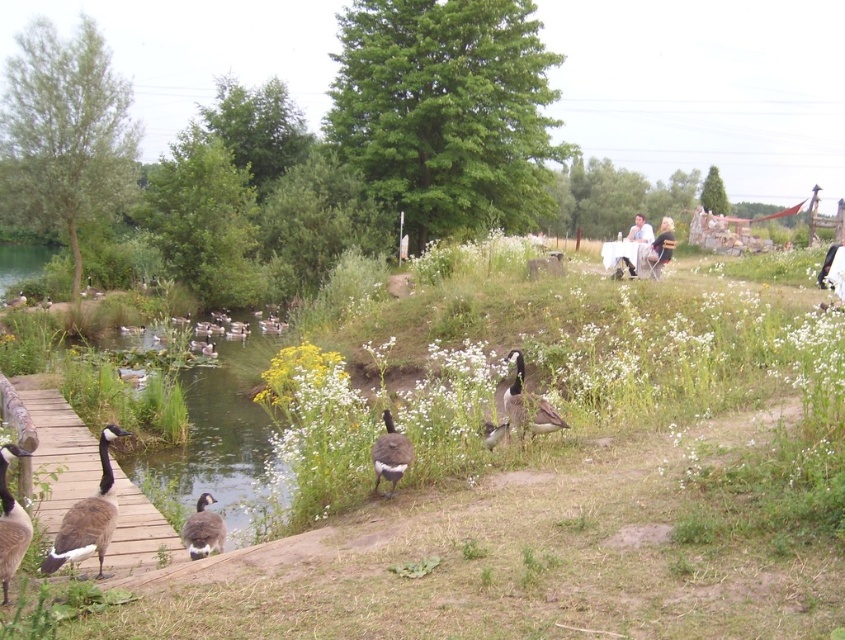
Where is `brown feathered duck at left`? Image resolution: width=845 pixels, height=640 pixels. brown feathered duck at left is located at coordinates (88, 516).

Is brown feathered duck at left thinner than gray matte duck at lower left?

Incorrect, brown feathered duck at left's width is not less than gray matte duck at lower left's.

Is point (107, 436) positioned behind point (211, 512)?

No, it is in front of (211, 512).

Locate an element on the screen. brown feathered duck at left is located at coordinates (88, 516).

Does white downy goose at center have a smaller size compared to white matte duck at center?

Incorrect, white downy goose at center is not smaller in size than white matte duck at center.

Who is positioned more to the right, white downy goose at center or white matte duck at center?

white downy goose at center is more to the right.

Where is `white downy goose at center`? white downy goose at center is located at coordinates (527, 404).

This screenshot has height=640, width=845. In order to click on white downy goose at center in this screenshot , I will do `click(527, 404)`.

Does brown fuzzy duck at center have a greater width compared to gray matte duck at lower left?

Incorrect, brown fuzzy duck at center's width does not surpass gray matte duck at lower left's.

Can you confirm if brown fuzzy duck at center is taller than gray matte duck at lower left?

Yes.

What do you see at coordinates (390, 454) in the screenshot? The height and width of the screenshot is (640, 845). I see `brown fuzzy duck at center` at bounding box center [390, 454].

You are a GUI agent. You are given a task and a screenshot of the screen. Output one action in this format:
    pyautogui.click(x=<x>, y=<y>)
    Task: Click on the brown fuzzy duck at center
    
    Given the screenshot: What is the action you would take?
    pyautogui.click(x=390, y=454)